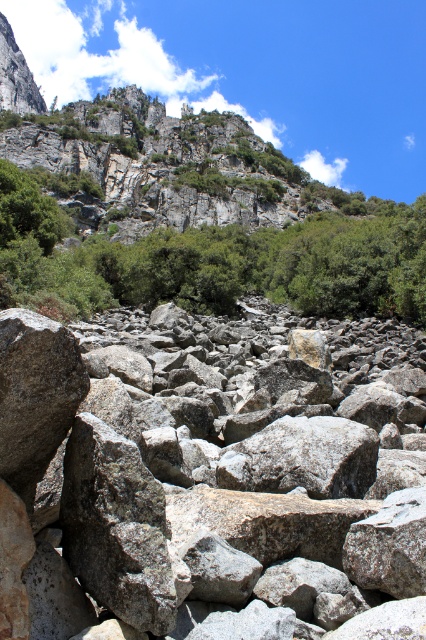
You are standing at the point with coordinates point (170, 285) and want to move towards the steep, rocky cliff in the background. There is an obstacle at point (186, 332). Will you be able to see the obstacle from your current position?

Point (186, 332) is in front of point (170, 285), so yes, you can see the obstacle at point (186, 332) from your current position at point (170, 285) because it is closer to the cliff and not blocked by any objects mentioned in the scene.

You are a hiker standing at the base of the cliff. You see the gray rock at center and the green leafy tree at upper center. Which object is closer to your current position?

The gray rock at center is closer to your current position because it is located below the green leafy tree at upper center, which is higher up the cliff.